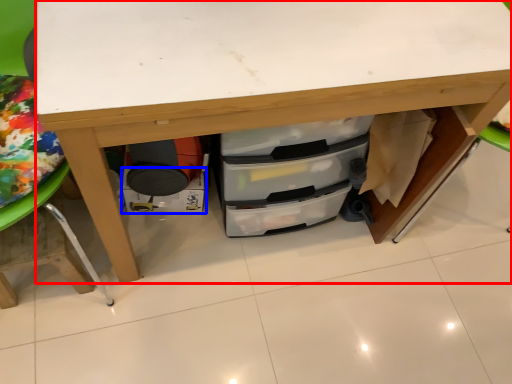
Question: Which point is closer to the camera, desk (highlighted by a red box) or drawer (highlighted by a blue box)?

Choices:
 (A) desk
 (B) drawer

Answer: (A)